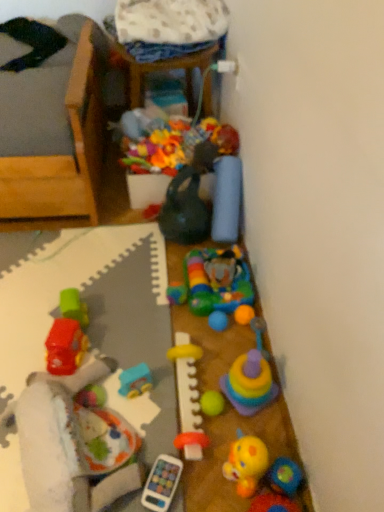
Where is `free space between orange rubber ball at center-right, the 10th toy from the left, and blue plastic toy car at center, positioned as the tenth toy in right-to-left order`? This screenshot has width=384, height=512. free space between orange rubber ball at center-right, the 10th toy from the left, and blue plastic toy car at center, positioned as the tenth toy in right-to-left order is located at coordinates (200, 350).